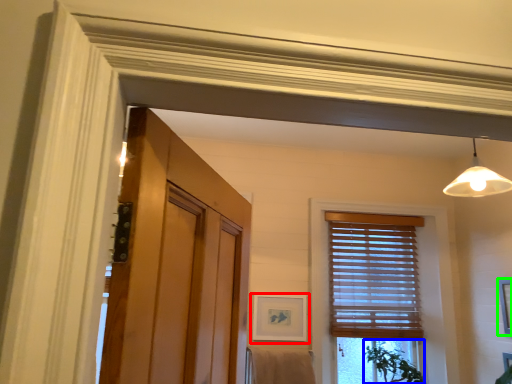
Question: Which object is the closest to the picture frame (highlighted by a red box)? Choose among these: plant (highlighted by a blue box) or picture frame (highlighted by a green box).

Choices:
 (A) plant
 (B) picture frame

Answer: (A)